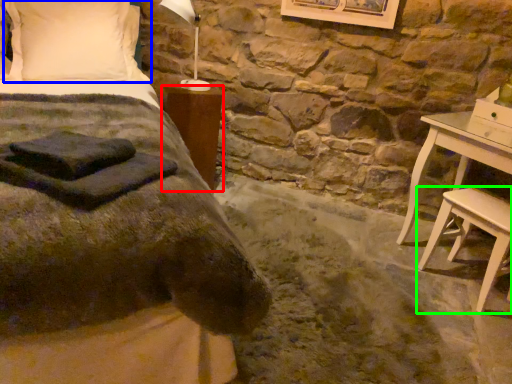
Question: Which object is the farthest from nightstand (highlighted by a red box)? Choose among these: pillow (highlighted by a blue box) or stool (highlighted by a green box).

Choices:
 (A) pillow
 (B) stool

Answer: (B)